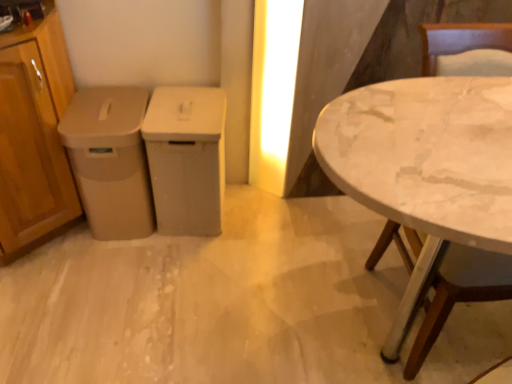
Question: Considering the relative sizes of wooden cabinet at left, the 3th cabinetry viewed from the right, and matte plastic trash can at center, which is counted as the 1th cabinetry, starting from the right, in the image provided, is wooden cabinet at left, the 3th cabinetry viewed from the right, thinner than matte plastic trash can at center, which is counted as the 1th cabinetry, starting from the right,?

Choices:
 (A) yes
 (B) no

Answer: (B)

Question: Is wooden cabinet at left, the 3th cabinetry viewed from the right, positioned in front of matte plastic trash can at center, the 3th cabinetry in the left-to-right sequence?

Choices:
 (A) yes
 (B) no

Answer: (A)

Question: Considering the relative positions of wooden cabinet at left, which ranks as the first cabinetry in left-to-right order, and matte plastic trash can at center, the 3th cabinetry in the left-to-right sequence, in the image provided, is wooden cabinet at left, which ranks as the first cabinetry in left-to-right order, to the left of matte plastic trash can at center, the 3th cabinetry in the left-to-right sequence, from the viewer's perspective?

Choices:
 (A) no
 (B) yes

Answer: (B)

Question: Considering the relative sizes of wooden cabinet at left, which ranks as the first cabinetry in left-to-right order, and matte plastic trash can at center, the 3th cabinetry in the left-to-right sequence, in the image provided, is wooden cabinet at left, which ranks as the first cabinetry in left-to-right order, bigger than matte plastic trash can at center, the 3th cabinetry in the left-to-right sequence,?

Choices:
 (A) yes
 (B) no

Answer: (A)

Question: Can you confirm if wooden cabinet at left, the 3th cabinetry viewed from the right, is taller than matte plastic trash can at center, the 3th cabinetry in the left-to-right sequence?

Choices:
 (A) yes
 (B) no

Answer: (A)

Question: Is white marble table at right situated inside matte plastic trash can at center, the 3th cabinetry in the left-to-right sequence, or outside?

Choices:
 (A) inside
 (B) outside

Answer: (B)

Question: Is white marble table at right wider or thinner than matte plastic trash can at center, the 3th cabinetry in the left-to-right sequence?

Choices:
 (A) thin
 (B) wide

Answer: (B)

Question: From a real-world perspective, relative to matte plastic trash can at center, which is counted as the 1th cabinetry, starting from the right, is white marble table at right vertically above or below?

Choices:
 (A) above
 (B) below

Answer: (A)

Question: Is white marble table at right taller or shorter than matte plastic trash can at center, the 3th cabinetry in the left-to-right sequence?

Choices:
 (A) tall
 (B) short

Answer: (A)

Question: Is beige plastic trash can at left, which is counted as the 2th cabinetry, starting from the right, wider or thinner than matte plastic trash can at center, which is counted as the 1th cabinetry, starting from the right?

Choices:
 (A) wide
 (B) thin

Answer: (A)

Question: Considering the positions of point (132, 235) and point (221, 188), is point (132, 235) closer or farther from the camera than point (221, 188)?

Choices:
 (A) farther
 (B) closer

Answer: (A)

Question: From the image's perspective, is beige plastic trash can at left, which is counted as the 2th cabinetry, starting from the right, located above or below matte plastic trash can at center, which is counted as the 1th cabinetry, starting from the right?

Choices:
 (A) above
 (B) below

Answer: (B)

Question: From a real-world perspective, is beige plastic trash can at left, which is counted as the 2th cabinetry, starting from the right, above or below matte plastic trash can at center, which is counted as the 1th cabinetry, starting from the right?

Choices:
 (A) above
 (B) below

Answer: (A)

Question: From a real-world perspective, is matte plastic trash can at center, the 3th cabinetry in the left-to-right sequence, positioned above or below wooden cabinet at left, the 3th cabinetry viewed from the right?

Choices:
 (A) above
 (B) below

Answer: (B)

Question: Considering the positions of point click(214, 183) and point click(71, 215), is point click(214, 183) closer or farther from the camera than point click(71, 215)?

Choices:
 (A) closer
 (B) farther

Answer: (A)